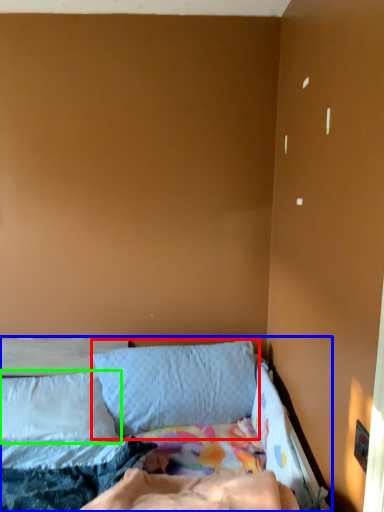
Question: Which is nearer to the pillow (highlighted by a red box)? bed (highlighted by a blue box) or pillow (highlighted by a green box).

Choices:
 (A) bed
 (B) pillow

Answer: (B)